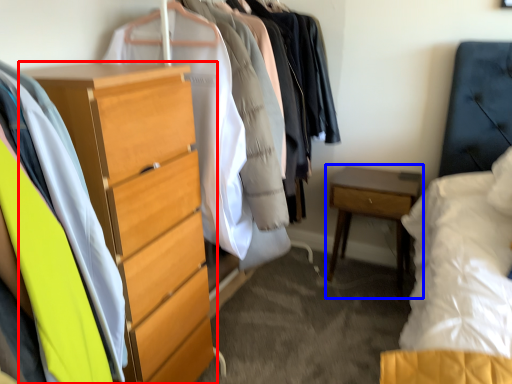
Question: Which point is closer to the camera, chest of drawers (highlighted by a red box) or nightstand (highlighted by a blue box)?

Choices:
 (A) chest of drawers
 (B) nightstand

Answer: (A)